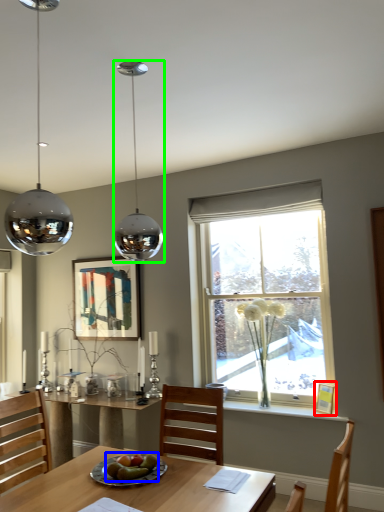
Question: Which object is the closest to the picture frame (highlighted by a red box)? Choose among these: food (highlighted by a blue box) or lamp (highlighted by a green box).

Choices:
 (A) food
 (B) lamp

Answer: (A)